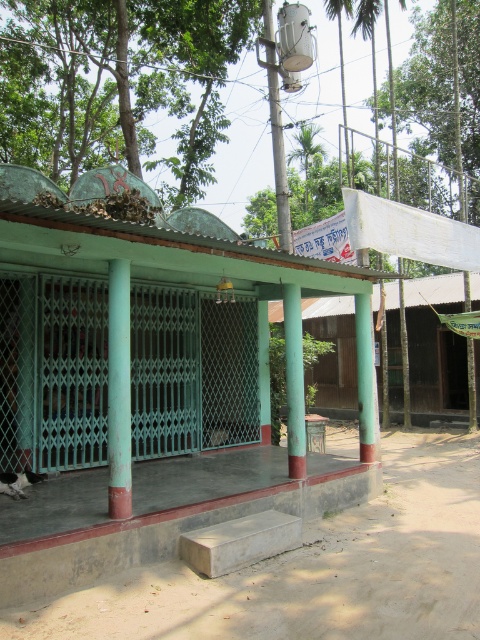
The image size is (480, 640). What do you see at coordinates (137, 353) in the screenshot?
I see `green painted metal hut at center` at bounding box center [137, 353].

Does point (67, 490) lie in front of point (435, 212)?

Yes, it is.

This screenshot has height=640, width=480. I want to click on green painted metal hut at center, so click(137, 353).

How much distance is there between green painted metal column at center and green matte column at center?

green painted metal column at center is 3.58 meters from green matte column at center.

Which is more to the right, green painted metal column at center or green matte column at center?

From the viewer's perspective, green matte column at center appears more on the right side.

Does point (124, 273) come in front of point (369, 353)?

Yes, point (124, 273) is closer to viewer.

At what (x,y) coordinates should I click in order to perform the action: click on green painted metal column at center. Please return your answer as a coordinate pair (x, y). The width and height of the screenshot is (480, 640). Looking at the image, I should click on pyautogui.click(x=119, y=388).

What do you see at coordinates (137, 353) in the screenshot? Image resolution: width=480 pixels, height=640 pixels. I see `green painted metal hut at center` at bounding box center [137, 353].

Can you confirm if green painted metal hut at center is shorter than green painted metal column at center?

In fact, green painted metal hut at center may be taller than green painted metal column at center.

Who is more forward, (252, 349) or (113, 413)?

Positioned in front is point (113, 413).

At what (x,y) coordinates should I click in order to perform the action: click on green painted metal hut at center. Please return your answer as a coordinate pair (x, y). This screenshot has width=480, height=640. Looking at the image, I should click on (137, 353).